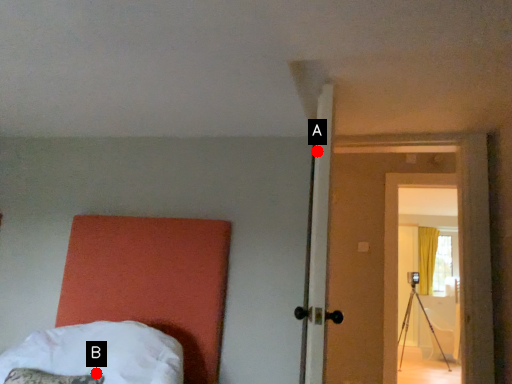
Question: Two points are circled on the image, labeled by A and B beside each circle. Which point is farther to the camera?

Choices:
 (A) A is further
 (B) B is further

Answer: (A)